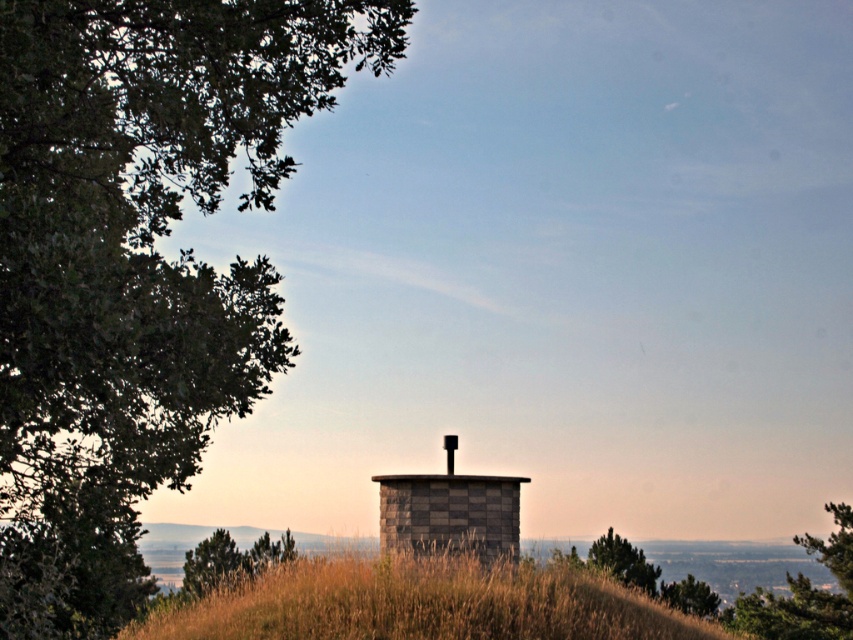
Is gray stone water tower at center to the left of green leafy tree at center from the viewer's perspective?

Yes, gray stone water tower at center is to the left of green leafy tree at center.

Is gray stone water tower at center taller than green leafy tree at center?

No, gray stone water tower at center is not taller than green leafy tree at center.

Between point (380, 552) and point (781, 621), which one is positioned in front?

Point (380, 552)

Where is `gray stone water tower at center`? gray stone water tower at center is located at coordinates (450, 513).

Who is lower down, green leafy tree at upper left or green textured tree at center?

Positioned lower is green textured tree at center.

Can you confirm if green leafy tree at upper left is smaller than green textured tree at center?

Incorrect, green leafy tree at upper left is not smaller in size than green textured tree at center.

Does point (28, 380) lie in front of point (622, 545)?

Yes, it is.

You are a GUI agent. You are given a task and a screenshot of the screen. Output one action in this format:
    pyautogui.click(x=<x>, y=<y>)
    Task: Click on the green leafy tree at upper left
    
    Given the screenshot: What is the action you would take?
    pyautogui.click(x=136, y=264)

Is green leafy tree at upper left thinner than green leafy tree at center?

Incorrect, green leafy tree at upper left's width is not less than green leafy tree at center's.

Between green leafy tree at upper left and green leafy tree at center, which one appears on the left side from the viewer's perspective?

green leafy tree at upper left is more to the left.

Locate an element on the screen. green leafy tree at upper left is located at coordinates (136, 264).

The image size is (853, 640). Find the location of `green leafy tree at upper left`. green leafy tree at upper left is located at coordinates (136, 264).